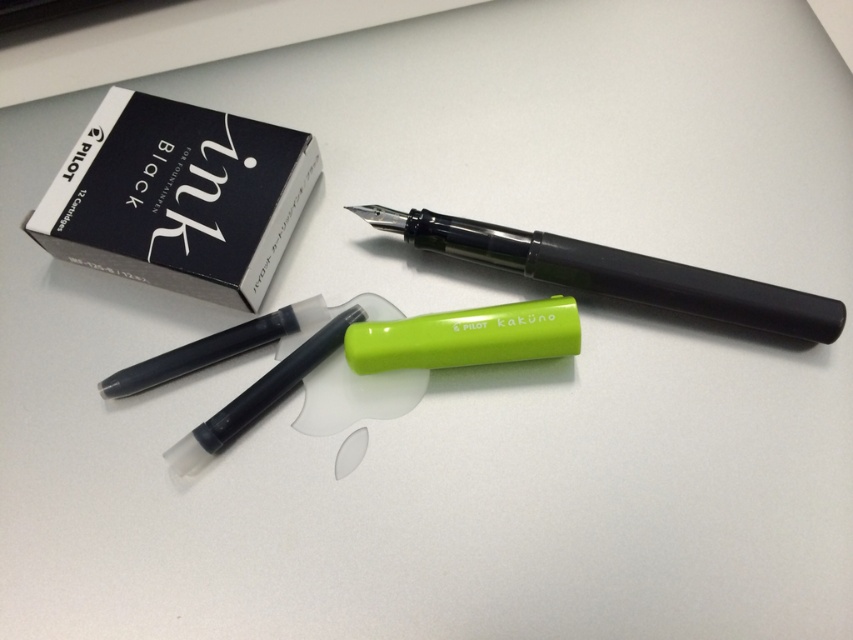
Question: Does black matte ink cartridge box at upper left appear on the left side of white matte eraser at center?

Choices:
 (A) yes
 (B) no

Answer: (A)

Question: Can you confirm if black matte ink cartridge box at upper left is positioned to the right of white matte eraser at center?

Choices:
 (A) yes
 (B) no

Answer: (B)

Question: Which object is closer to the camera taking this photo?

Choices:
 (A) matte black fountain pen at center
 (B) black matte ink cartridge box at upper left

Answer: (A)

Question: Is black matte ink cartridge box at upper left in front of matte black fountain pen at center?

Choices:
 (A) yes
 (B) no

Answer: (B)

Question: Which of the following is the farthest from the observer?

Choices:
 (A) black matte ink cartridge box at upper left
 (B) matte black fountain pen at center

Answer: (A)

Question: Which object is farther from the camera taking this photo?

Choices:
 (A) black matte ink cartridge box at upper left
 (B) white matte eraser at center
 (C) matte black fountain pen at center

Answer: (A)